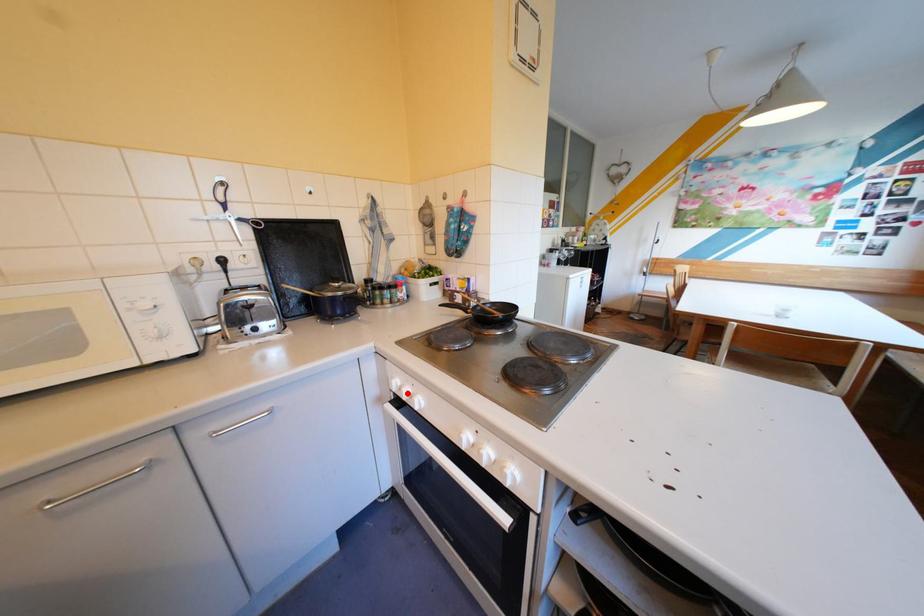
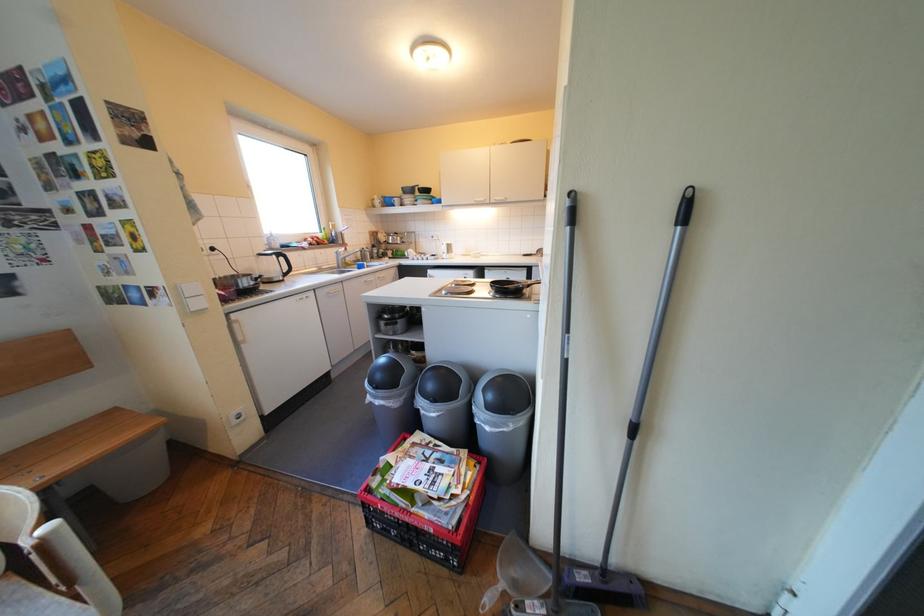
Question: I am providing you with two images of the same scene from different viewpoints. A red point is marked on the first image. Is the red point's position out of view in image 2?

Choices:
 (A) Yes
 (B) No

Answer: (A)